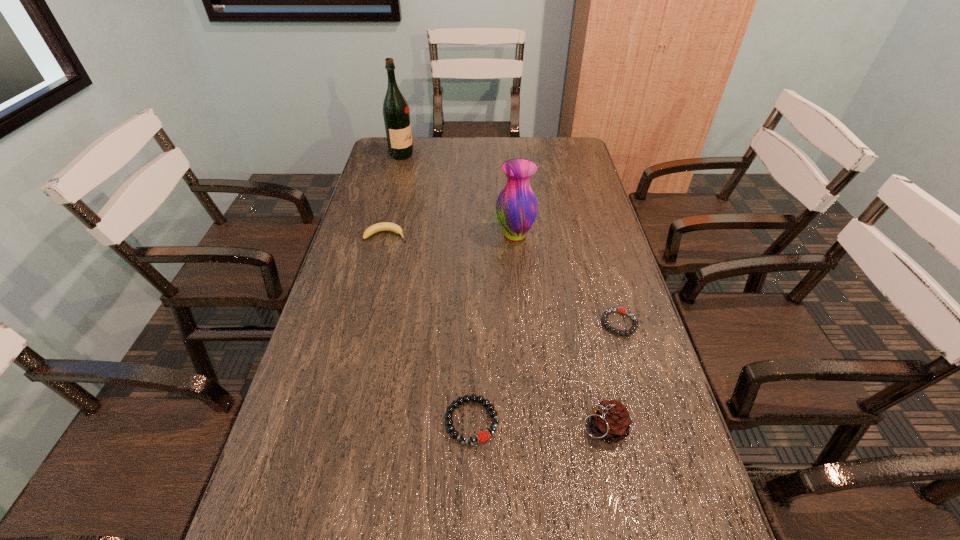
Identify the location of liquor at the left edge. (396, 115).

The image size is (960, 540). Find the location of `banana situated at the left edge`. banana situated at the left edge is located at coordinates (383, 226).

The width and height of the screenshot is (960, 540). Find the location of `pinecone that is positioned at the right edge`. pinecone that is positioned at the right edge is located at coordinates (610, 420).

Identify the location of bracelet situated at the right edge. (633, 328).

Where is `object at the far left corner`? This screenshot has height=540, width=960. object at the far left corner is located at coordinates (396, 115).

Where is `vacant area at the far edge of the desktop`? The image size is (960, 540). vacant area at the far edge of the desktop is located at coordinates (495, 158).

The image size is (960, 540). In the image, there is a desktop. Find the location of `vacant area at the left edge`. vacant area at the left edge is located at coordinates (349, 282).

This screenshot has height=540, width=960. What are the coordinates of `free space at the right edge of the desktop` in the screenshot? It's located at (635, 341).

Where is `vacant space at the far left corner of the desktop`? vacant space at the far left corner of the desktop is located at coordinates (375, 154).

In the image, there is a desktop. Where is `vacant space at the far right corner`? vacant space at the far right corner is located at coordinates [559, 139].